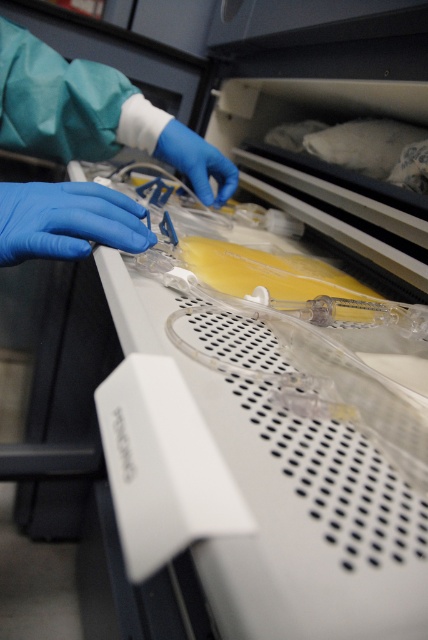
You are a medical assistant preparing to use the white device with the perforated front panel. You have two blue latex gloves at upper left and a blue latex glove at center. Which pair of gloves should you choose if you need a larger size for better grip?

The blue latex gloves at upper left are larger in width than the blue latex glove at center, so you should choose the blue latex gloves at upper left for better grip.

You are a medical student observing a procedure and need to identify the gloves. Which of the two gloves, the blue latex gloves at upper left or the blue rubber glove at left, is taller?

The blue latex gloves at upper left is much taller than the blue rubber glove at left.

You are a medical assistant in the lab. You need to put on the blue latex gloves at upper left and the blue latex glove at center. Which one should you pick up first if you want to follow the left to right order?

You should pick up the blue latex gloves at upper left first because it is located to the left of the blue latex glove at center.